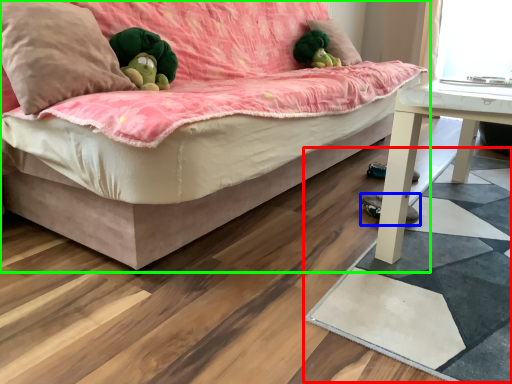
Question: Which is nearer to the mat (highlighted by a red box)? footwear (highlighted by a blue box) or studio couch (highlighted by a green box).

Choices:
 (A) footwear
 (B) studio couch

Answer: (A)